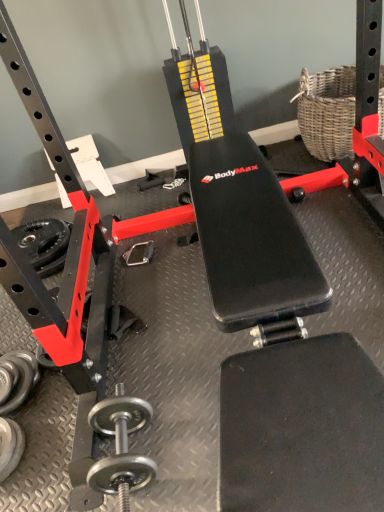
Question: Considering the positions of point (11, 398) and point (296, 105), is point (11, 398) closer or farther from the camera than point (296, 105)?

Choices:
 (A) closer
 (B) farther

Answer: (A)

Question: From the image's perspective, is silver metallic dumbbell at lower left, which is the third dumbbell in right-to-left order, located above or below woven wicker basket at upper right?

Choices:
 (A) above
 (B) below

Answer: (B)

Question: Based on their relative distances, which object is farther from the rubberized black weight at lower left?

Choices:
 (A) polished silver dumbbell at lower left, marked as the first dumbbell in a right-to-left arrangement
 (B) silver metallic dumbbell at lower left, placed as the 2th dumbbell when sorted from right to left
 (C) silver metallic dumbbell at lower left, which is the third dumbbell in right-to-left order
 (D) woven wicker basket at upper right

Answer: (D)

Question: Based on their relative distances, which object is farther from the silver metallic dumbbell at lower left, which is the third dumbbell in right-to-left order?

Choices:
 (A) woven wicker basket at upper right
 (B) rubberized black weight at lower left
 (C) silver metallic dumbbell at lower left, placed as the 2th dumbbell when sorted from right to left
 (D) polished silver dumbbell at lower left, which ranks as the third dumbbell in left-to-right order

Answer: (A)